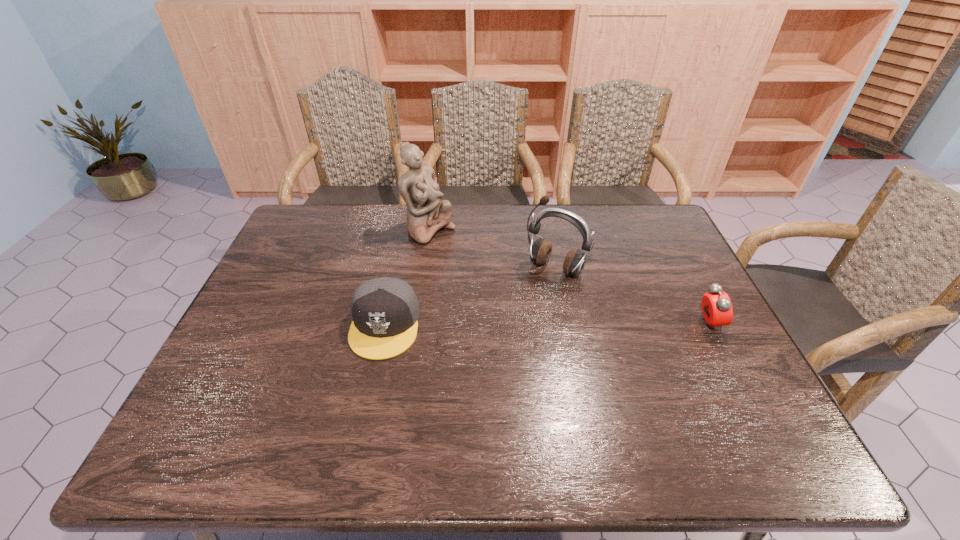
Where is `object identified as the closest to the cap`? object identified as the closest to the cap is located at coordinates click(426, 213).

Identify which object is the closest to the rightmost object. Please provide its 2D coordinates. Your answer should be formatted as a tuple, i.e. [(x, y)], where the tuple contains the x and y coordinates of a point satisfying the conditions above.

[(540, 251)]

Locate an element on the screen. This screenshot has height=540, width=960. free space that satisfies the following two spatial constraints: 1. on the front side of the rightmost object; 2. on the front-facing side of the second object from right to left is located at coordinates (566, 324).

What are the coordinates of `free space in the image that satisfies the following two spatial constraints: 1. on the front side of the earphone; 2. on the left side of the figurine` in the screenshot? It's located at (424, 268).

I want to click on blank space that satisfies the following two spatial constraints: 1. on the front side of the farthest object; 2. on the right side of the third shortest object, so click(424, 268).